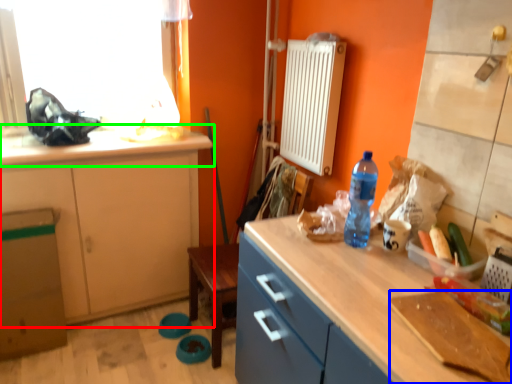
Question: Estimate the real-world distances between objects in this image. Which object is closer to cabinetry (highlighted by a red box), cutting board (highlighted by a blue box) or countertop (highlighted by a green box)?

Choices:
 (A) cutting board
 (B) countertop

Answer: (B)